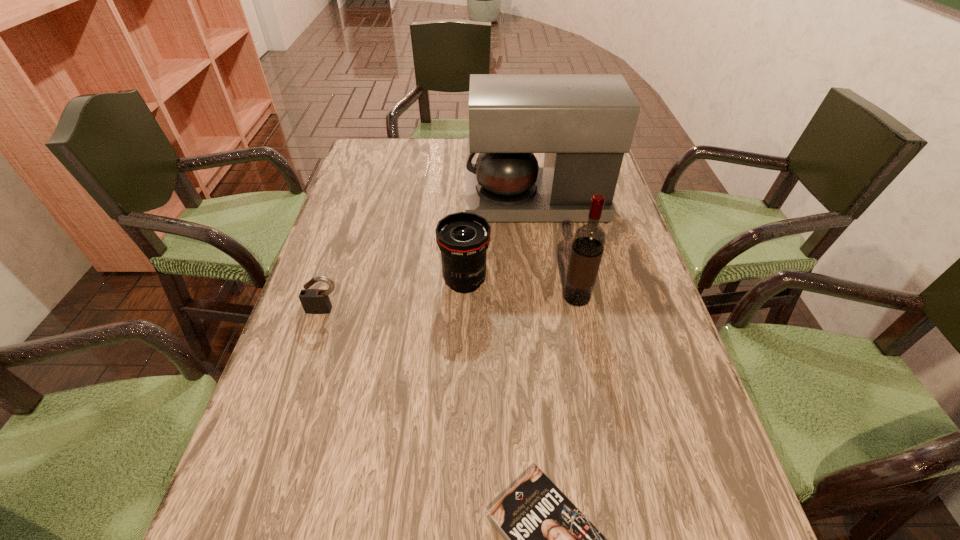
In order to click on vacant area in the image that satisfies the following two spatial constraints: 1. on the carafe side of the farthest object; 2. on the back side of the wine bottle in this screenshot , I will do `click(551, 298)`.